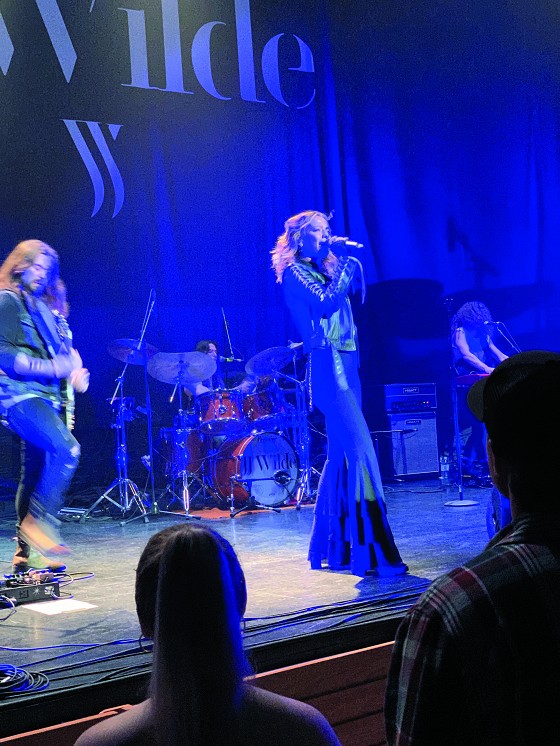
Locate an element on the screen. Image resolution: width=560 pixels, height=746 pixels. cords is located at coordinates (12, 677), (18, 680), (42, 683), (65, 668), (72, 653), (74, 645), (10, 612), (79, 577).